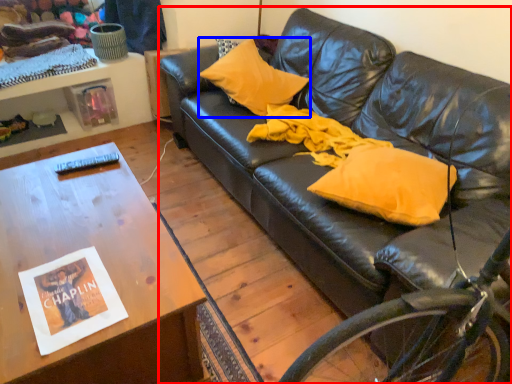
Question: Which object appears farthest to the camera in this image, studio couch (highlighted by a red box) or pillow (highlighted by a blue box)?

Choices:
 (A) studio couch
 (B) pillow

Answer: (B)